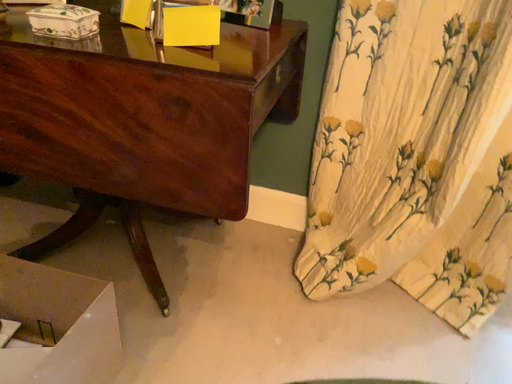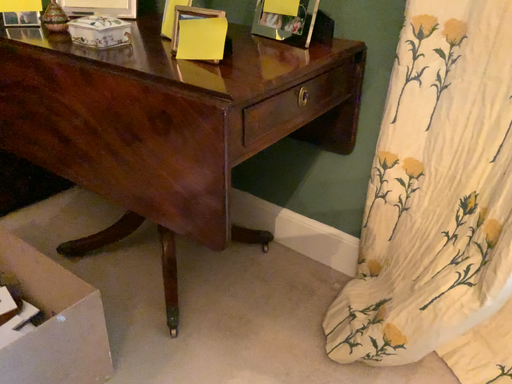
Question: How did the camera likely rotate when shooting the video?

Choices:
 (A) rotated right
 (B) rotated left

Answer: (B)